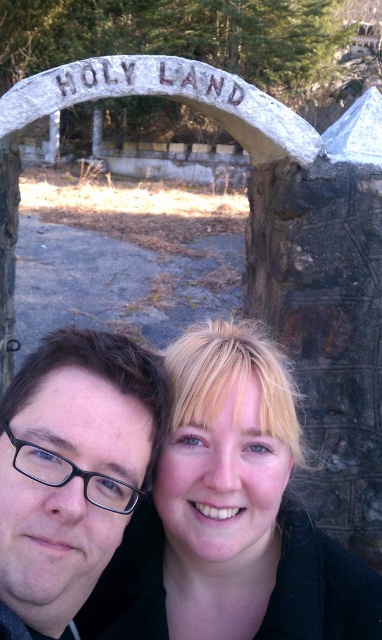
Question: Does blonde hair at center appear over matte black glasses at center?

Choices:
 (A) no
 (B) yes

Answer: (A)

Question: In this image, where is blonde hair at center located relative to matte black glasses at center?

Choices:
 (A) left
 (B) right

Answer: (B)

Question: Which of the following is the farthest from the observer?

Choices:
 (A) matte black glasses at center
 (B) blonde hair at center

Answer: (B)

Question: Which object is closer to the camera taking this photo?

Choices:
 (A) blonde hair at center
 (B) matte black glasses at center

Answer: (B)

Question: Is blonde hair at center thinner than matte black glasses at center?

Choices:
 (A) no
 (B) yes

Answer: (A)

Question: Which point is closer to the camera taking this photo?

Choices:
 (A) (320, 577)
 (B) (163, 410)

Answer: (B)